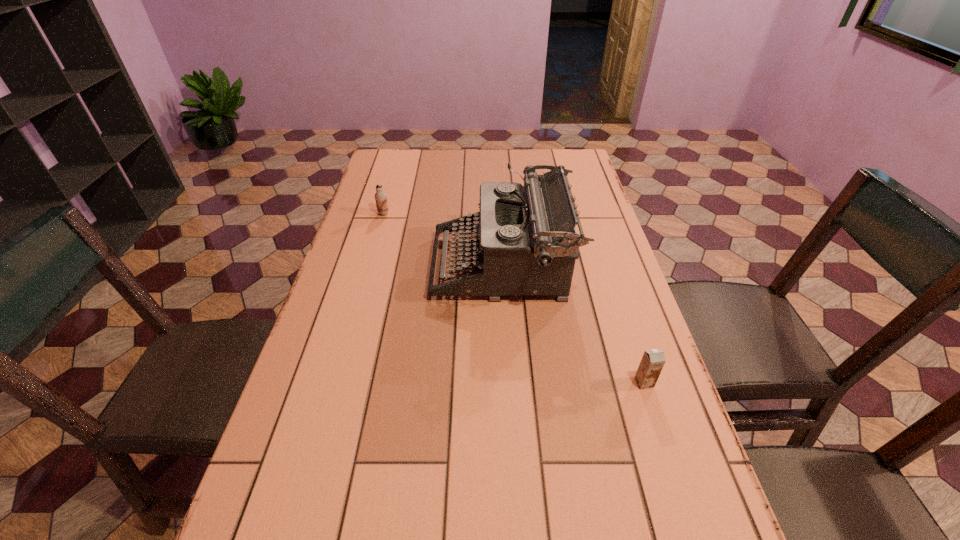
Where is `the tallest object`? the tallest object is located at coordinates (528, 245).

The image size is (960, 540). Identify the location of the second nearest object. (528, 245).

At what (x,y) coordinates should I click in order to perform the action: click on the farther chocolate milk. Please return your answer as a coordinate pair (x, y). Looking at the image, I should click on (380, 196).

The height and width of the screenshot is (540, 960). I want to click on the farthest object, so click(x=380, y=196).

Find the location of a particular element. The height and width of the screenshot is (540, 960). the rightmost object is located at coordinates (652, 362).

Where is `the right chocolate milk`? the right chocolate milk is located at coordinates (652, 362).

This screenshot has height=540, width=960. Find the location of `vacant region located on the typing side of the tallest object`. vacant region located on the typing side of the tallest object is located at coordinates (401, 266).

Image resolution: width=960 pixels, height=540 pixels. What are the coordinates of `vacant space located 0.170m on the typing side of the tallest object` in the screenshot? It's located at (372, 266).

This screenshot has height=540, width=960. In order to click on vacant position located on the typing side of the tallest object in this screenshot , I will do `click(341, 266)`.

You are a GUI agent. You are given a task and a screenshot of the screen. Output one action in this format:
    pyautogui.click(x=<x>, y=<y>)
    Task: Click on the vacant space situated on the front of the left chocolate milk
    The width and height of the screenshot is (960, 540).
    Given the screenshot: What is the action you would take?
    pyautogui.click(x=375, y=244)